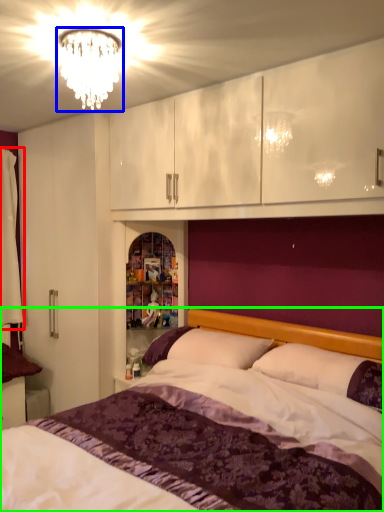
Question: Which object is positioned closest to curtain (highlighted by a red box)? Select from fixture (highlighted by a blue box) and bed (highlighted by a green box).

Choices:
 (A) fixture
 (B) bed

Answer: (A)